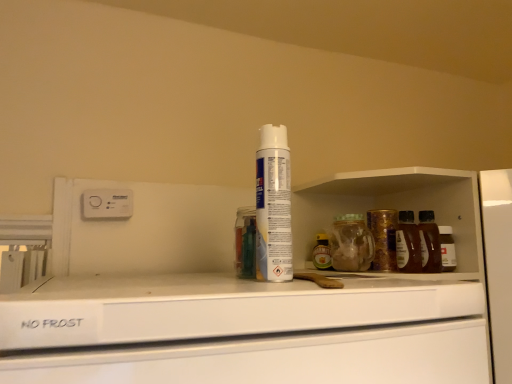
At what (x,y) coordinates should I click in order to perform the action: click on white plastic electric outlet at upper left. Please return your answer as a coordinate pair (x, y). Looking at the image, I should click on (106, 203).

The image size is (512, 384). What do you see at coordinates (106, 203) in the screenshot?
I see `white plastic electric outlet at upper left` at bounding box center [106, 203].

Locate an element on the screen. The width and height of the screenshot is (512, 384). white matte shaving cream at center is located at coordinates (273, 206).

This screenshot has width=512, height=384. What do you see at coordinates (273, 206) in the screenshot? I see `white matte shaving cream at center` at bounding box center [273, 206].

Locate an element on the screen. This screenshot has height=384, width=512. white plastic electric outlet at upper left is located at coordinates tap(106, 203).

Does white plastic electric outlet at upper left appear on the left side of white matte shaving cream at center?

Yes, white plastic electric outlet at upper left is to the left of white matte shaving cream at center.

Which object is closer to the camera taking this photo, white plastic electric outlet at upper left or white matte shaving cream at center?

Positioned in front is white matte shaving cream at center.

Does point (128, 215) come in front of point (279, 265)?

No, it is behind (279, 265).

From the image's perspective, relative to white matte shaving cream at center, is white plastic electric outlet at upper left above or below?

Clearly, from the image's perspective, white plastic electric outlet at upper left is below white matte shaving cream at center.

From a real-world perspective, is white plastic electric outlet at upper left positioned above or below white matte shaving cream at center?

white plastic electric outlet at upper left is situated higher than white matte shaving cream at center in the real world.

Which of these two, white plastic electric outlet at upper left or white matte shaving cream at center, is wider?

Wider between the two is white matte shaving cream at center.

Considering the relative sizes of white plastic electric outlet at upper left and white matte shaving cream at center in the image provided, is white plastic electric outlet at upper left taller than white matte shaving cream at center?

In fact, white plastic electric outlet at upper left may be shorter than white matte shaving cream at center.

From the picture: Considering the sizes of objects white plastic electric outlet at upper left and white matte shaving cream at center in the image provided, who is smaller, white plastic electric outlet at upper left or white matte shaving cream at center?

white plastic electric outlet at upper left.

Looking at this image, would you say white plastic electric outlet at upper left is outside white matte shaving cream at center?

That's correct, white plastic electric outlet at upper left is outside of white matte shaving cream at center.

Is there a large distance between white plastic electric outlet at upper left and white matte shaving cream at center?

No, white plastic electric outlet at upper left is not far from white matte shaving cream at center.

Is white plastic electric outlet at upper left aimed at white matte shaving cream at center?

Yes, white plastic electric outlet at upper left is aimed at white matte shaving cream at center.

How far apart are white plastic electric outlet at upper left and white matte shaving cream at center?

They are 18.01 inches apart.

Locate an element on the screen. The height and width of the screenshot is (384, 512). shaving cream above the white plastic electric outlet at upper left (from the image's perspective) is located at coordinates (273, 206).

In the image, is white matte shaving cream at center on the left side or the right side of white plastic electric outlet at upper left?

From the image, it's evident that white matte shaving cream at center is to the right of white plastic electric outlet at upper left.

Considering the positions of objects white matte shaving cream at center and white plastic electric outlet at upper left in the image provided, who is behind, white matte shaving cream at center or white plastic electric outlet at upper left?

white plastic electric outlet at upper left is more distant.

Is point (273, 142) positioned in front of point (113, 197)?

Yes.

From the image's perspective, would you say white matte shaving cream at center is positioned over white plastic electric outlet at upper left?

Correct, white matte shaving cream at center appears higher than white plastic electric outlet at upper left in the image.

From a real-world perspective, is white matte shaving cream at center over white plastic electric outlet at upper left?

Incorrect, from a real-world perspective, white matte shaving cream at center is lower than white plastic electric outlet at upper left.

Is white matte shaving cream at center wider than white plastic electric outlet at upper left?

Indeed, white matte shaving cream at center has a greater width compared to white plastic electric outlet at upper left.

Who is taller, white matte shaving cream at center or white plastic electric outlet at upper left?

white matte shaving cream at center.

Based on their sizes in the image, would you say white matte shaving cream at center is bigger or smaller than white plastic electric outlet at upper left?

white matte shaving cream at center is bigger than white plastic electric outlet at upper left.

Is white matte shaving cream at center surrounding white plastic electric outlet at upper left?

No, white plastic electric outlet at upper left is not a part of white matte shaving cream at center.

Are white matte shaving cream at center and white plastic electric outlet at upper left beside each other?

No, white matte shaving cream at center is not next to white plastic electric outlet at upper left.

Is white matte shaving cream at center turned away from white plastic electric outlet at upper left?

No, white plastic electric outlet at upper left is not at the back of white matte shaving cream at center.

How many degrees apart are the facing directions of white matte shaving cream at center and white plastic electric outlet at upper left?

There is a 4-degree angle between the facing directions of white matte shaving cream at center and white plastic electric outlet at upper left.

Measure the distance from white matte shaving cream at center to white plastic electric outlet at upper left.

white matte shaving cream at center is 18.01 inches away from white plastic electric outlet at upper left.

Find the location of a particular element. electric outlet on the left of white matte shaving cream at center is located at coordinates (106, 203).

Locate an element on the screen. The image size is (512, 384). electric outlet above the white matte shaving cream at center (from a real-world perspective) is located at coordinates (106, 203).

In order to click on shaving cream lying on the right of white plastic electric outlet at upper left in this screenshot , I will do `click(273, 206)`.